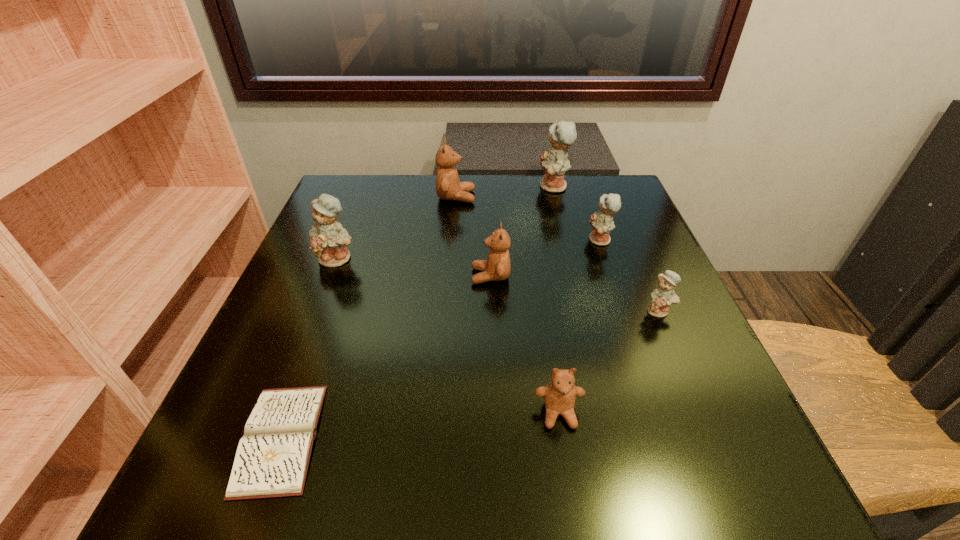
The height and width of the screenshot is (540, 960). I want to click on the nearest brown teddy bear, so click(x=559, y=395).

Find the location of `the smallest brown teddy bear`. the smallest brown teddy bear is located at coordinates (559, 395).

Identify the location of the shortest object. (272, 458).

The width and height of the screenshot is (960, 540). What are the coordinates of `blank space located on the front-facing side of the biggest blue teddy bear` in the screenshot? It's located at (496, 187).

Where is `vacant space located on the front-facing side of the biggest blue teddy bear`? vacant space located on the front-facing side of the biggest blue teddy bear is located at coordinates (433, 187).

I want to click on vacant space located 0.250m on the front-facing side of the biggest blue teddy bear, so click(444, 187).

I want to click on free region located 0.050m on the face of the farthest brown teddy bear, so click(494, 197).

You are a GUI agent. You are given a task and a screenshot of the screen. Output one action in this format:
    pyautogui.click(x=<x>, y=<y>)
    Task: Click on the vacant region located on the front-facing side of the leftmost blue teddy bear
    The height and width of the screenshot is (540, 960).
    Given the screenshot: What is the action you would take?
    pyautogui.click(x=309, y=330)

Find the location of a particular element. vacant space located on the front-facing side of the third biggest blue teddy bear is located at coordinates (565, 240).

The height and width of the screenshot is (540, 960). In order to click on vacant position located on the front-facing side of the third biggest blue teddy bear in this screenshot , I will do `click(410, 240)`.